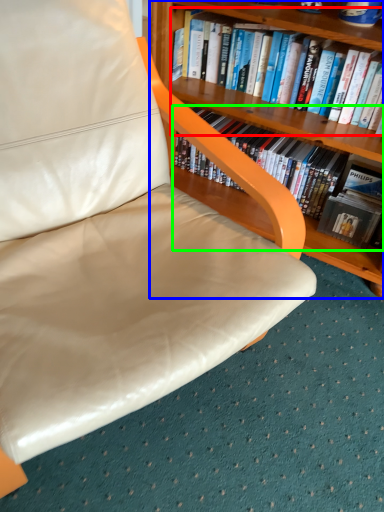
Question: Which object is positioned closest to book (highlighted by a red box)? Select from bookcase (highlighted by a blue box) and book (highlighted by a green box).

Choices:
 (A) bookcase
 (B) book

Answer: (A)